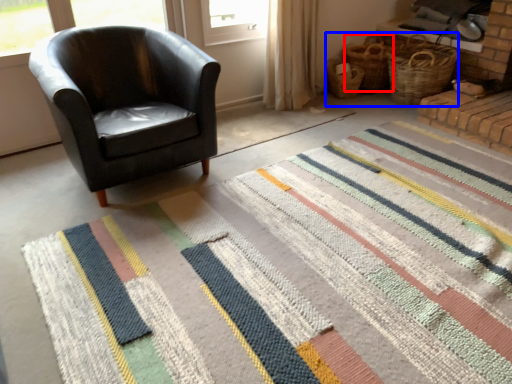
Question: Among these objects, which one is nearest to the camera, basket (highlighted by a red box) or basket (highlighted by a blue box)?

Choices:
 (A) basket
 (B) basket

Answer: (B)